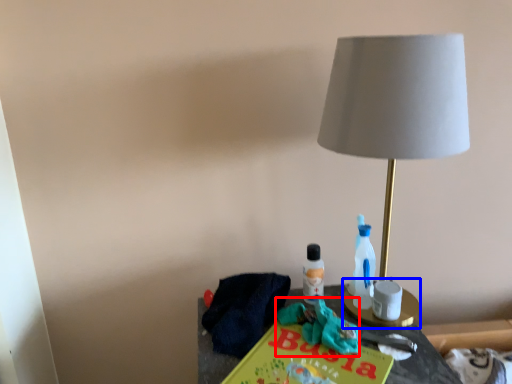
Question: Among these objects, which one is nearest to the camera, scrub (highlighted by a red box) or candle holder (highlighted by a blue box)?

Choices:
 (A) scrub
 (B) candle holder

Answer: (A)